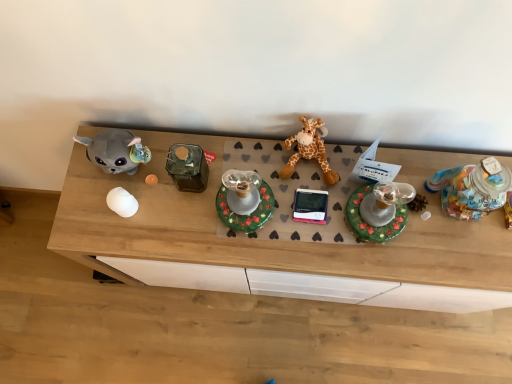
Locate an element on the screen. vacant space positioned to the left of white glossy egg at center, which is the first toy from left to right is located at coordinates (86, 214).